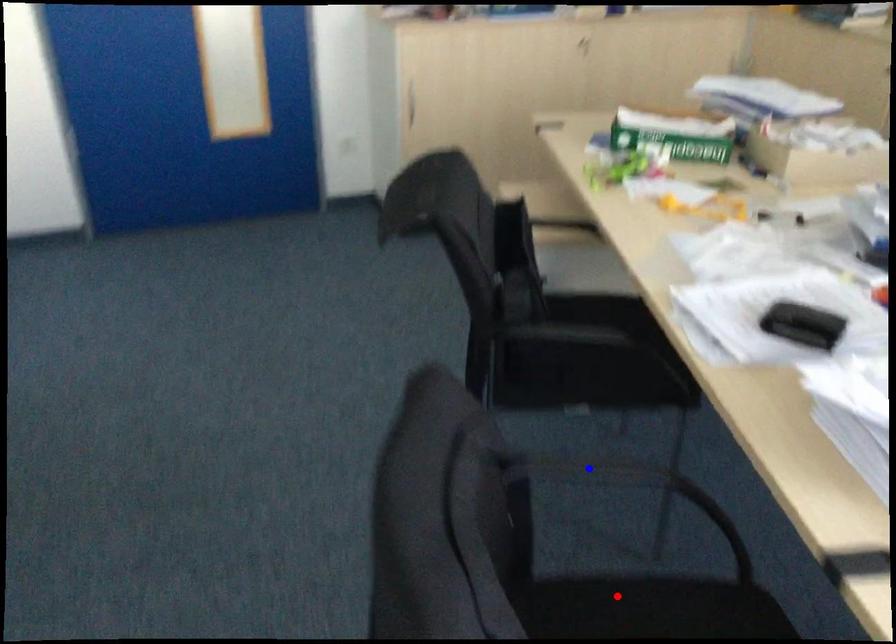
Question: Two points are marked on the image. Which point is closer to the camera?

Choices:
 (A) Blue point is closer.
 (B) Red point is closer.

Answer: (B)